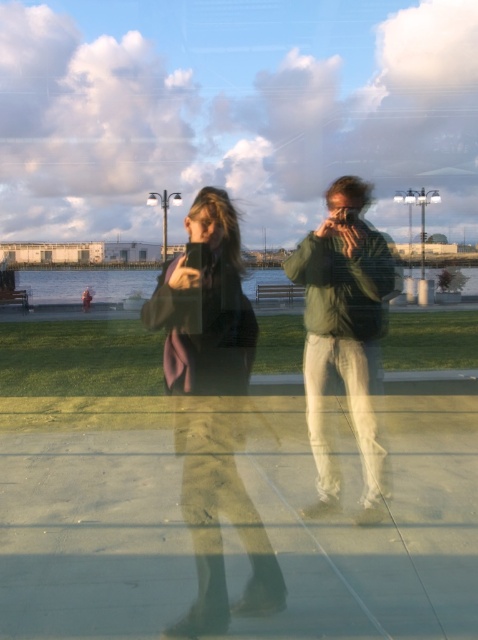
Is matte black jacket at center above green matte jacket at center?

Actually, matte black jacket at center is below green matte jacket at center.

Is matte black jacket at center to the right of green matte jacket at center from the viewer's perspective?

Incorrect, matte black jacket at center is not on the right side of green matte jacket at center.

What do you see at coordinates (214, 416) in the screenshot? This screenshot has width=478, height=640. I see `matte black jacket at center` at bounding box center [214, 416].

You are a GUI agent. You are given a task and a screenshot of the screen. Output one action in this format:
    pyautogui.click(x=<x>, y=<y>)
    Task: Click on the matte black jacket at center
    This screenshot has height=640, width=478.
    Given the screenshot: What is the action you would take?
    pyautogui.click(x=214, y=416)